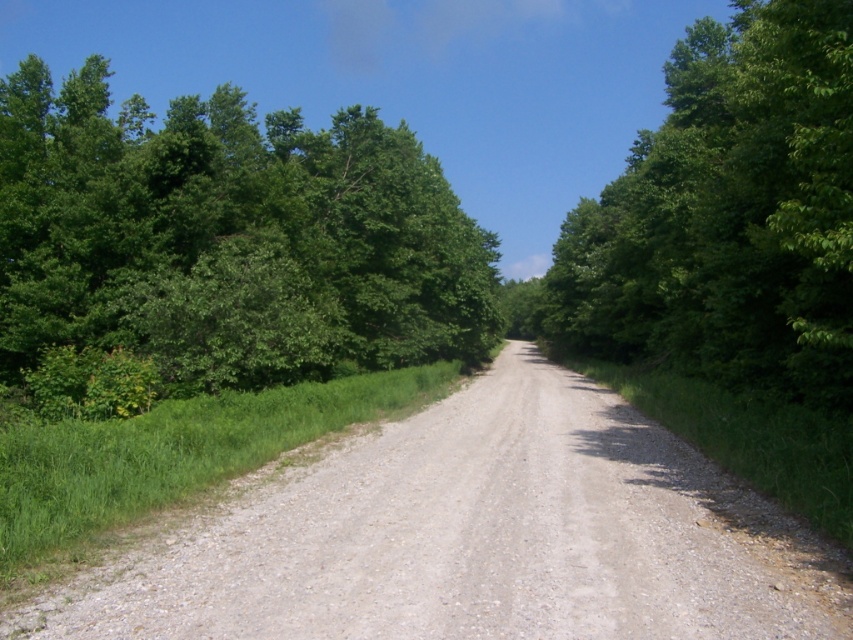
Question: Does gray gravel road at center have a greater width compared to green leafy tree at left?

Choices:
 (A) no
 (B) yes

Answer: (A)

Question: Among these objects, which one is nearest to the camera?

Choices:
 (A) green leafy tree at left
 (B) green leafy tree at right

Answer: (B)

Question: Can you confirm if green leafy tree at left is bigger than green leafy tree at right?

Choices:
 (A) no
 (B) yes

Answer: (B)

Question: Which point is farther to the camera?

Choices:
 (A) (238, 310)
 (B) (355, 444)
 (C) (679, 129)

Answer: (C)

Question: Which object is closer to the camera taking this photo?

Choices:
 (A) green leafy tree at right
 (B) gray gravel road at center

Answer: (B)

Question: Does gray gravel road at center have a larger size compared to green leafy tree at left?

Choices:
 (A) no
 (B) yes

Answer: (A)